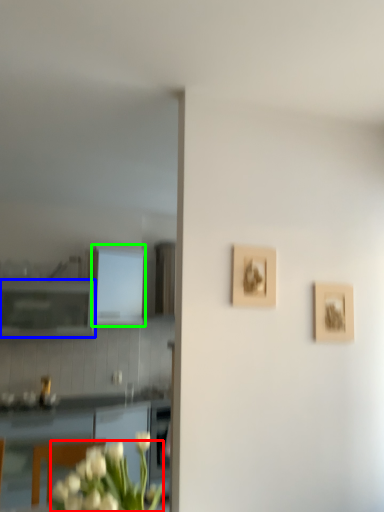
Question: Which object is the closest to the flower (highlighted by a red box)? Choose among these: cabinetry (highlighted by a blue box) or cabinetry (highlighted by a green box).

Choices:
 (A) cabinetry
 (B) cabinetry

Answer: (A)